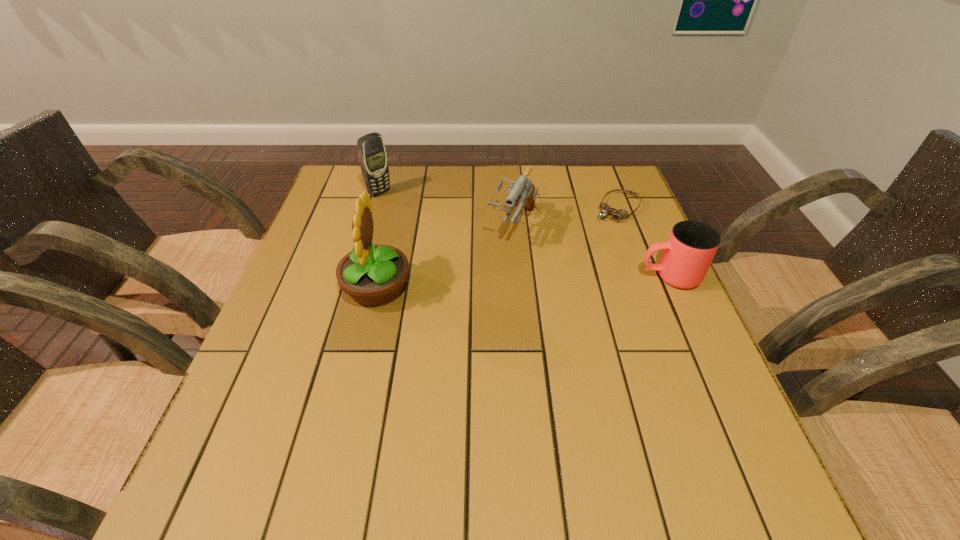
You are a GUI agent. You are given a task and a screenshot of the screen. Output one action in this format:
    pyautogui.click(x=<x>, y=<y>)
    Task: Click on the vacant region located on the front face of the cellular telephone
    The width and height of the screenshot is (960, 540).
    Given the screenshot: What is the action you would take?
    pyautogui.click(x=453, y=244)

Identify the location of goggles that is at the far edge. (605, 210).

Locate an element on the screen. The height and width of the screenshot is (540, 960). gun located at the far edge is located at coordinates (523, 188).

The width and height of the screenshot is (960, 540). Find the location of `cellular telephone located at the far edge`. cellular telephone located at the far edge is located at coordinates (372, 155).

Where is `sunflower that is at the left edge`? Image resolution: width=960 pixels, height=540 pixels. sunflower that is at the left edge is located at coordinates click(373, 275).

What are the coordinates of `cellular telephone positioned at the left edge` in the screenshot? It's located at (372, 155).

Find the location of `cup located in the right edge section of the desktop`. cup located in the right edge section of the desktop is located at coordinates (691, 246).

You are a GUI agent. You are given a task and a screenshot of the screen. Output one action in this format:
    pyautogui.click(x=<x>, y=<y>)
    Task: Click on the goggles present at the right edge
    The width and height of the screenshot is (960, 540).
    Given the screenshot: What is the action you would take?
    pyautogui.click(x=605, y=210)

This screenshot has width=960, height=540. Identify the location of object located in the far left corner section of the desktop. (372, 155).

The image size is (960, 540). What are the coordinates of `object at the far right corner` in the screenshot? It's located at (605, 210).